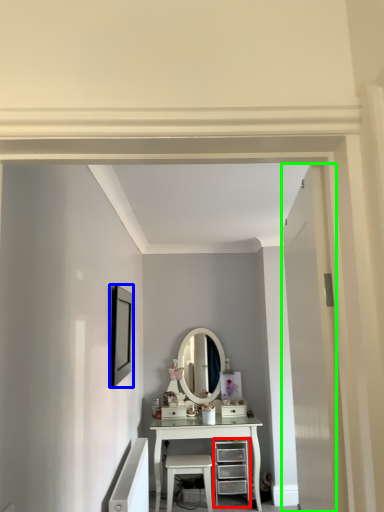
Question: Estimate the real-world distances between objects in this image. Which object is farther from chest of drawers (highlighted by a red box), picture frame (highlighted by a blue box) or door (highlighted by a green box)?

Choices:
 (A) picture frame
 (B) door

Answer: (B)